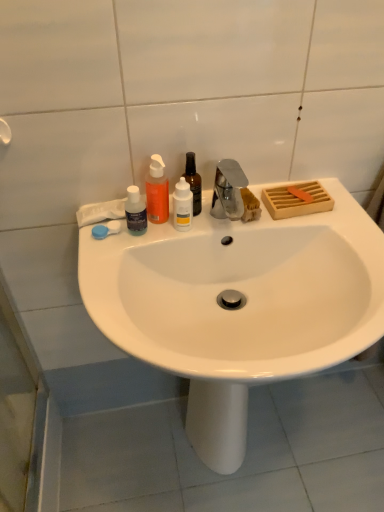
In order to click on free location to the right of matte black bottle at left, which is the 1th bottle in left-to-right order in this screenshot , I will do `click(200, 228)`.